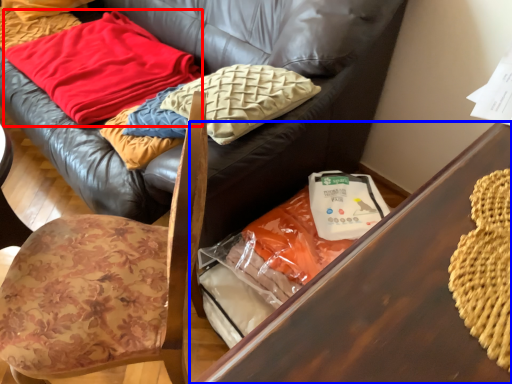
Question: Which of the following is the closest to the observer, blanket (highlighted by a red box) or table (highlighted by a blue box)?

Choices:
 (A) blanket
 (B) table

Answer: (B)